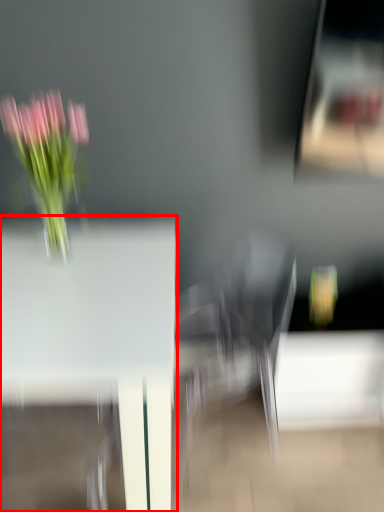
Question: From the image's perspective, considering the relative positions of table (annotated by the red box) and floral arrangement in the image provided, where is table (annotated by the red box) located with respect to the staircase?

Choices:
 (A) below
 (B) above

Answer: (A)